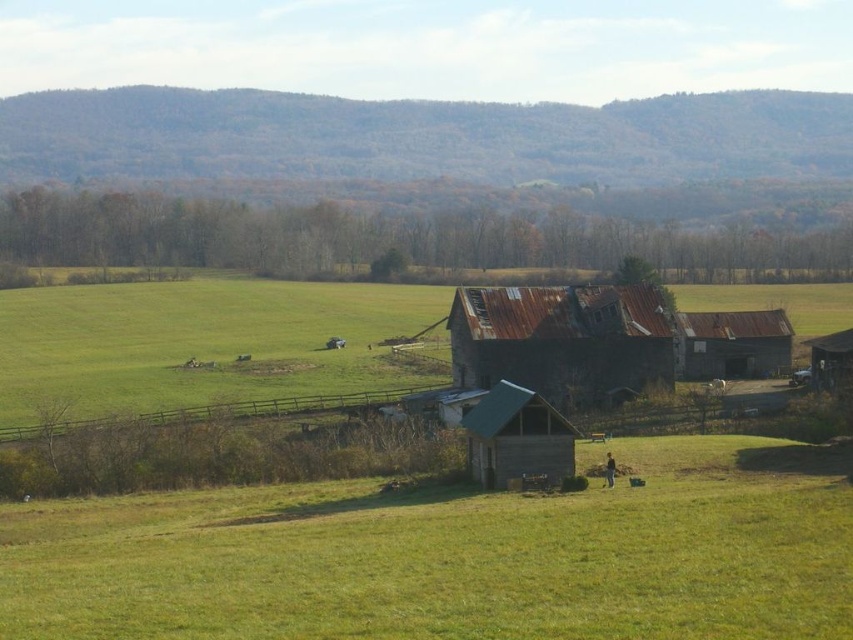
You are planning to store a large farming equipment. Which of the two structures, the rusty metal barn at center or the rusty metal hut at center, would be more suitable based on their sizes?

The rusty metal barn at center is larger in size than the rusty metal hut at center, making it more suitable for storing large farming equipment.

You are standing at the point with coordinates (x=454, y=556) in the image. What is the immediate terrain beneath your feet?

The immediate terrain beneath your feet at point (x=454, y=556) is green grassy field at lower center.